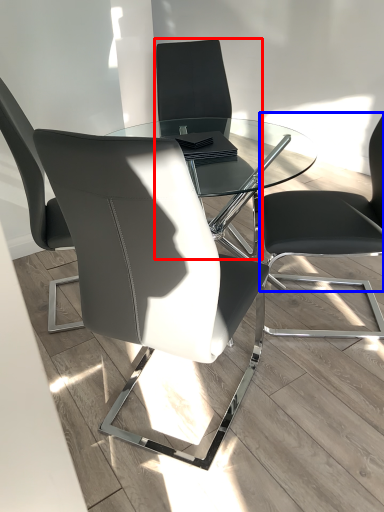
Question: Among these objects, which one is nearest to the camera, chair (highlighted by a red box) or chair (highlighted by a blue box)?

Choices:
 (A) chair
 (B) chair

Answer: (B)